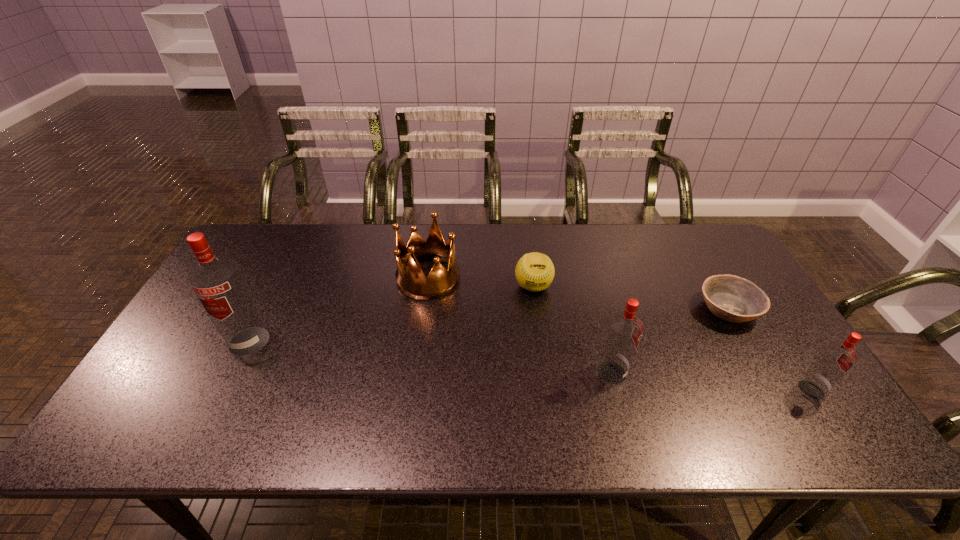
To make them evenly spaced by inserting another vodka among them, please locate a free space for this new vodka. Please provide its 2D coordinates. Your answer should be formatted as a tuple, i.e. [(x, y)], where the tuple contains the x and y coordinates of a point satisfying the conditions above.

[(424, 356)]